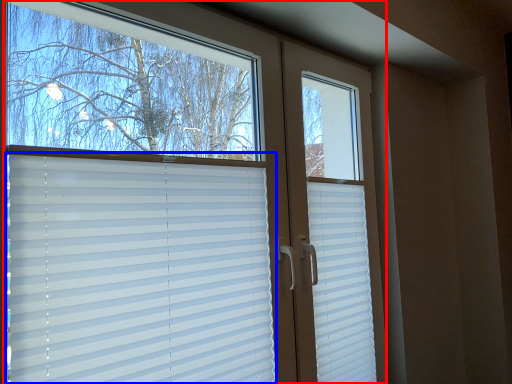
Question: Which object is closer to the camera taking this photo, window (highlighted by a red box) or window blind (highlighted by a blue box)?

Choices:
 (A) window
 (B) window blind

Answer: (A)